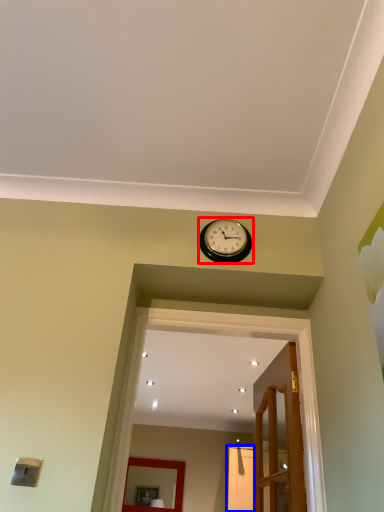
Question: Which object is closer to the camera taking this photo, wall clock (highlighted by a red box) or glass door (highlighted by a blue box)?

Choices:
 (A) wall clock
 (B) glass door

Answer: (A)